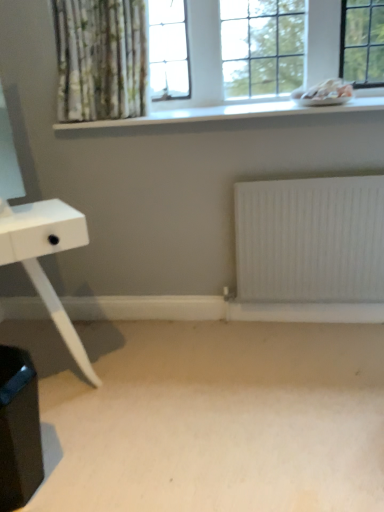
Question: Is white matte table at left next to white glass window at upper center and touching it?

Choices:
 (A) no
 (B) yes

Answer: (A)

Question: Is white matte table at left aimed at white glass window at upper center?

Choices:
 (A) yes
 (B) no

Answer: (B)

Question: Is white matte table at left further to the viewer compared to white glass window at upper center?

Choices:
 (A) yes
 (B) no

Answer: (B)

Question: Is white matte table at left bigger than white glass window at upper center?

Choices:
 (A) no
 (B) yes

Answer: (B)

Question: Would you say white matte table at left contains white glass window at upper center?

Choices:
 (A) yes
 (B) no

Answer: (B)

Question: From a real-world perspective, is white matte table at left over white glass window at upper center?

Choices:
 (A) yes
 (B) no

Answer: (B)

Question: Does white smooth window sill at upper center lie in front of white matte table at left?

Choices:
 (A) no
 (B) yes

Answer: (A)

Question: Does white smooth window sill at upper center have a greater width compared to white matte table at left?

Choices:
 (A) yes
 (B) no

Answer: (B)

Question: Is white smooth window sill at upper center with white matte table at left?

Choices:
 (A) no
 (B) yes

Answer: (A)

Question: Considering the relative sizes of white smooth window sill at upper center and white matte table at left in the image provided, is white smooth window sill at upper center smaller than white matte table at left?

Choices:
 (A) yes
 (B) no

Answer: (A)

Question: Is white smooth window sill at upper center not near white matte table at left?

Choices:
 (A) yes
 (B) no

Answer: (B)

Question: Is white smooth window sill at upper center outside of white matte table at left?

Choices:
 (A) yes
 (B) no

Answer: (A)

Question: Does beige carpet at lower center come behind white matte radiator at lower center?

Choices:
 (A) no
 (B) yes

Answer: (A)